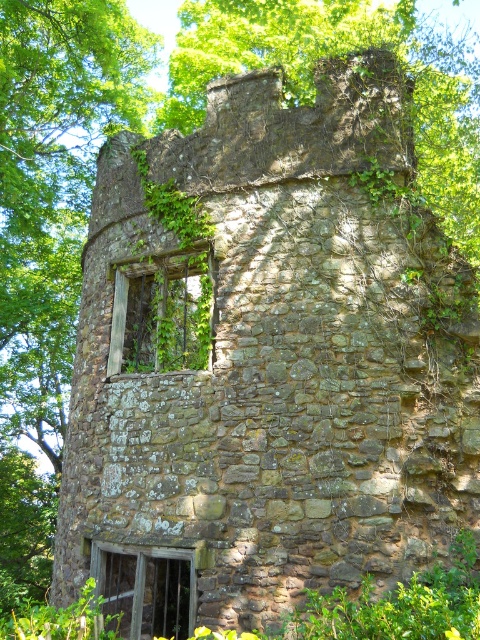
Question: Can you confirm if green mossy stone window at upper left is bigger than wooden textured window at lower left?

Choices:
 (A) no
 (B) yes

Answer: (B)

Question: Which point is closer to the camera?

Choices:
 (A) (151, 364)
 (B) (146, 548)

Answer: (B)

Question: Which point is closer to the camera taking this photo?

Choices:
 (A) (157, 609)
 (B) (206, 301)

Answer: (B)

Question: Does green mossy stone window at upper left appear under wooden textured window at lower left?

Choices:
 (A) no
 (B) yes

Answer: (A)

Question: Is green mossy stone window at upper left thinner than wooden textured window at lower left?

Choices:
 (A) no
 (B) yes

Answer: (A)